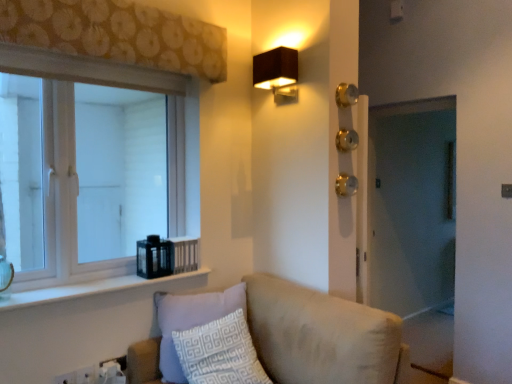
Question: Does clear glass vase at left lie behind white glossy window sill at lower left?

Choices:
 (A) no
 (B) yes

Answer: (A)

Question: Can you confirm if clear glass vase at left is bigger than white glossy window sill at lower left?

Choices:
 (A) yes
 (B) no

Answer: (B)

Question: From the image's perspective, would you say clear glass vase at left is positioned over white glossy window sill at lower left?

Choices:
 (A) no
 (B) yes

Answer: (B)

Question: From a real-world perspective, does clear glass vase at left stand above white glossy window sill at lower left?

Choices:
 (A) no
 (B) yes

Answer: (B)

Question: Is clear glass vase at left oriented towards white glossy window sill at lower left?

Choices:
 (A) no
 (B) yes

Answer: (A)

Question: From a real-world perspective, does clear glass vase at left sit lower than white glossy window sill at lower left?

Choices:
 (A) yes
 (B) no

Answer: (B)

Question: Is gold metallic door handle at center-right bigger than brown floral fabric at upper left?

Choices:
 (A) yes
 (B) no

Answer: (B)

Question: Is brown floral fabric at upper left a part of gold metallic door handle at center-right?

Choices:
 (A) yes
 (B) no

Answer: (B)

Question: Considering the relative sizes of gold metallic door handle at center-right and brown floral fabric at upper left in the image provided, is gold metallic door handle at center-right smaller than brown floral fabric at upper left?

Choices:
 (A) yes
 (B) no

Answer: (A)

Question: Does gold metallic door handle at center-right appear on the right side of brown floral fabric at upper left?

Choices:
 (A) no
 (B) yes

Answer: (B)

Question: From a real-world perspective, is gold metallic door handle at center-right below brown floral fabric at upper left?

Choices:
 (A) yes
 (B) no

Answer: (A)

Question: From the image's perspective, is gold metallic door handle at center-right on brown floral fabric at upper left?

Choices:
 (A) yes
 (B) no

Answer: (B)

Question: Can you confirm if gold metallic door handle at center-right is smaller than white glossy window sill at lower left?

Choices:
 (A) no
 (B) yes

Answer: (B)